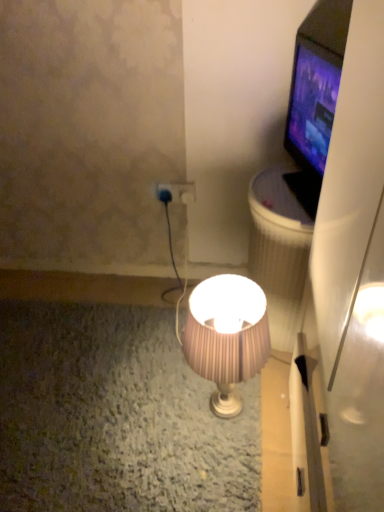
Question: Does matte black tv at upper right have a greater width compared to pink pleated fabric lampshade at center?

Choices:
 (A) yes
 (B) no

Answer: (B)

Question: Does matte black tv at upper right come in front of pink pleated fabric lampshade at center?

Choices:
 (A) yes
 (B) no

Answer: (B)

Question: Can you confirm if matte black tv at upper right is positioned to the right of pink pleated fabric lampshade at center?

Choices:
 (A) yes
 (B) no

Answer: (A)

Question: Is matte black tv at upper right taller than pink pleated fabric lampshade at center?

Choices:
 (A) yes
 (B) no

Answer: (B)

Question: Is matte black tv at upper right behind pink pleated fabric lampshade at center?

Choices:
 (A) no
 (B) yes

Answer: (B)

Question: Considering the positions of point (256, 216) and point (286, 182), is point (256, 216) closer or farther from the camera than point (286, 182)?

Choices:
 (A) closer
 (B) farther

Answer: (A)

Question: Is white textured trash can at right in front of or behind matte black tv at upper right in the image?

Choices:
 (A) front
 (B) behind

Answer: (B)

Question: From a real-world perspective, is white textured trash can at right positioned above or below matte black tv at upper right?

Choices:
 (A) above
 (B) below

Answer: (B)

Question: From their relative heights in the image, would you say white textured trash can at right is taller or shorter than matte black tv at upper right?

Choices:
 (A) short
 (B) tall

Answer: (B)

Question: Considering the positions of point (314, 35) and point (289, 173), is point (314, 35) closer or farther from the camera than point (289, 173)?

Choices:
 (A) closer
 (B) farther

Answer: (A)

Question: In the image, is matte black tv at upper right positioned in front of or behind white textured trash can at right?

Choices:
 (A) behind
 (B) front

Answer: (B)

Question: Is matte black tv at upper right to the left or to the right of white textured trash can at right in the image?

Choices:
 (A) right
 (B) left

Answer: (A)

Question: From their relative heights in the image, would you say matte black tv at upper right is taller or shorter than white textured trash can at right?

Choices:
 (A) short
 (B) tall

Answer: (A)

Question: From the image's perspective, is pink pleated fabric lampshade at center above or below blue plastic plug at center?

Choices:
 (A) below
 (B) above

Answer: (A)

Question: Is pink pleated fabric lampshade at center taller or shorter than blue plastic plug at center?

Choices:
 (A) tall
 (B) short

Answer: (A)